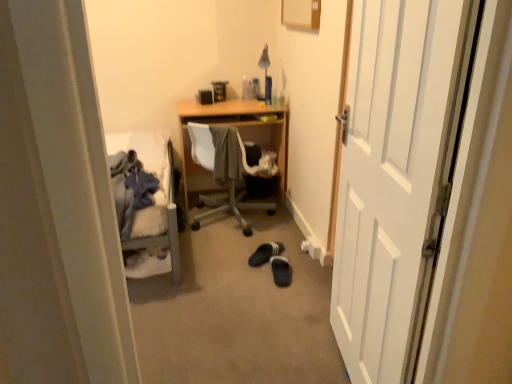
The width and height of the screenshot is (512, 384). Describe the element at coordinates (201, 145) in the screenshot. I see `wooden chair at center` at that location.

This screenshot has height=384, width=512. Describe the element at coordinates (226, 155) in the screenshot. I see `gray fabric at center, which ranks as the second clothing in left-to-right order` at that location.

Where is `gray fabric at center, the 1th clothing viewed from the right`? The height and width of the screenshot is (384, 512). gray fabric at center, the 1th clothing viewed from the right is located at coordinates (226, 155).

You are a GUI agent. You are given a task and a screenshot of the screen. Output one action in this format:
    pyautogui.click(x=<x>, y=<y>)
    Task: Click on the denim jacket at left, the second clothing in the right-to-left sequence
    The height and width of the screenshot is (384, 512).
    Given the screenshot: What is the action you would take?
    pyautogui.click(x=130, y=189)

The image size is (512, 384). Describe the element at coordinates (130, 189) in the screenshot. I see `denim jacket at left, marked as the 1th clothing in a left-to-right arrangement` at that location.

Measure the distance between point (280, 243) and camera.

A distance of 9.14 feet exists between point (280, 243) and camera.

What do you see at coordinates (265, 253) in the screenshot?
I see `black suede slippers at center, the first footwear in the back-to-front sequence` at bounding box center [265, 253].

You are a GUI agent. You are given a task and a screenshot of the screen. Output one action in this format:
    pyautogui.click(x=<x>, y=<y>)
    Task: Click on the wooden chair at center
    
    Given the screenshot: What is the action you would take?
    pyautogui.click(x=201, y=145)

From a real-world perspective, between denim jacket at left, the second clothing when ordered from back to front, and gray fabric at center, which is the 1th clothing in back-to-front order, who is vertically lower?

In real-world perspective, gray fabric at center, which is the 1th clothing in back-to-front order, is lower.

Considering the positions of point (123, 167) and point (233, 137), is point (123, 167) closer or farther from the camera than point (233, 137)?

Point (123, 167).

Is denim jacket at left, marked as the 1th clothing in a left-to-right arrangement, directly adjacent to gray fabric at center, which ranks as the second clothing in left-to-right order?

No, denim jacket at left, marked as the 1th clothing in a left-to-right arrangement, is not making contact with gray fabric at center, which ranks as the second clothing in left-to-right order.

Between denim jacket at left, marked as the 1th clothing in a front-to-back arrangement, and gray fabric at center, which is the 1th clothing in back-to-front order, which one has smaller size?

Smaller between the two is denim jacket at left, marked as the 1th clothing in a front-to-back arrangement.

Is gray fabric at center, which is counted as the 2th clothing, starting from the front, touching black suede slippers at center, the first footwear in the back-to-front sequence?

No, gray fabric at center, which is counted as the 2th clothing, starting from the front, is not with black suede slippers at center, the first footwear in the back-to-front sequence.

Choose the correct answer: Is gray fabric at center, which is the 1th clothing in back-to-front order, inside black suede slippers at center, positioned as the second footwear in front-to-back order, or outside it?

gray fabric at center, which is the 1th clothing in back-to-front order, lies outside black suede slippers at center, positioned as the second footwear in front-to-back order.

Consider the image. Is gray fabric at center, which is the 1th clothing in back-to-front order, bigger than black suede slippers at center, positioned as the second footwear in front-to-back order?

Yes.

Is gray fabric at center, the 1th clothing viewed from the right, looking in the opposite direction of black suede slippers at center, the first footwear in the back-to-front sequence?

No, gray fabric at center, the 1th clothing viewed from the right, is not facing away from black suede slippers at center, the first footwear in the back-to-front sequence.

Is black suede slippers at center floor, positioned as the second footwear in back-to-front order, facing away from wooden chair at center?

Absolutely, black suede slippers at center floor, positioned as the second footwear in back-to-front order, is directed away from wooden chair at center.

Does black suede slippers at center floor, arranged as the 1th footwear when viewed from the front, have a lesser height compared to wooden chair at center?

Correct, black suede slippers at center floor, arranged as the 1th footwear when viewed from the front, is not as tall as wooden chair at center.

Is black suede slippers at center floor, arranged as the 1th footwear when viewed from the front, positioned far away from wooden chair at center?

That's not correct — black suede slippers at center floor, arranged as the 1th footwear when viewed from the front, is a little close to wooden chair at center.

Is wooden chair at center oriented away from black suede slippers at center floor, arranged as the 1th footwear when viewed from the front?

wooden chair at center is not turned away from black suede slippers at center floor, arranged as the 1th footwear when viewed from the front.

Does wooden chair at center lie in front of black suede slippers at center floor, positioned as the second footwear in back-to-front order?

No, it is behind black suede slippers at center floor, positioned as the second footwear in back-to-front order.

From the image's perspective, which is below, wooden chair at center or black suede slippers at center floor, arranged as the 1th footwear when viewed from the front?

black suede slippers at center floor, arranged as the 1th footwear when viewed from the front.

Is white wooden door at right inside the boundaries of black suede slippers at center floor, positioned as the second footwear in back-to-front order, or outside?

white wooden door at right lies outside black suede slippers at center floor, positioned as the second footwear in back-to-front order.

From a real-world perspective, is white wooden door at right positioned above or below black suede slippers at center floor, positioned as the second footwear in back-to-front order?

From a real-world perspective, white wooden door at right is physically above black suede slippers at center floor, positioned as the second footwear in back-to-front order.

Looking at this image, from the image's perspective, is white wooden door at right over black suede slippers at center floor, positioned as the second footwear in back-to-front order?

Correct, white wooden door at right appears higher than black suede slippers at center floor, positioned as the second footwear in back-to-front order, in the image.

You are a GUI agent. You are given a task and a screenshot of the screen. Output one action in this format:
    pyautogui.click(x=<x>, y=<y>)
    Task: Click on the door lying in front of the black suede slippers at center floor, positioned as the second footwear in back-to-front order
    
    Given the screenshot: What is the action you would take?
    pyautogui.click(x=397, y=175)

Is point (244, 226) positioned in front of point (345, 182)?

No, (244, 226) is behind (345, 182).

Are wooden chair at center and white wooden door at right located far from each other?

Indeed, wooden chair at center is not near white wooden door at right.

Is wooden chair at center to the left or to the right of white wooden door at right in the image?

Based on their positions, wooden chair at center is located to the left of white wooden door at right.

Is white wooden door at right inside wooden chair at center?

No, white wooden door at right is not a part of wooden chair at center.

Is black suede slippers at center floor, positioned as the second footwear in back-to-front order, taller or shorter than black suede slippers at center, the first footwear in the back-to-front sequence?

Clearly, black suede slippers at center floor, positioned as the second footwear in back-to-front order, is shorter compared to black suede slippers at center, the first footwear in the back-to-front sequence.

Looking at their sizes, would you say black suede slippers at center floor, positioned as the second footwear in back-to-front order, is wider or thinner than black suede slippers at center, positioned as the second footwear in front-to-back order?

Considering their sizes, black suede slippers at center floor, positioned as the second footwear in back-to-front order, looks slimmer than black suede slippers at center, positioned as the second footwear in front-to-back order.

Does black suede slippers at center floor, positioned as the second footwear in back-to-front order, come in front of black suede slippers at center, positioned as the second footwear in front-to-back order?

Yes.

Is black suede slippers at center floor, positioned as the second footwear in back-to-front order, not near black suede slippers at center, positioned as the second footwear in front-to-back order?

Actually, black suede slippers at center floor, positioned as the second footwear in back-to-front order, and black suede slippers at center, positioned as the second footwear in front-to-back order, are a little close together.

At what (x,y) coordinates should I click in order to perform the action: click on clothing above the gray fabric at center, which is counted as the 2th clothing, starting from the front (from a real-world perspective). Please return your answer as a coordinate pair (x, y). This screenshot has width=512, height=384. Looking at the image, I should click on (130, 189).

You are a GUI agent. You are given a task and a screenshot of the screen. Output one action in this format:
    pyautogui.click(x=<x>, y=<y>)
    Task: Click on the 1st footwear counting from the right of the gray fabric at center, which is the 1th clothing in back-to-front order
    
    Given the screenshot: What is the action you would take?
    pyautogui.click(x=265, y=253)

Considering their positions, is denim jacket at left, the second clothing when ordered from back to front, positioned closer to wooden chair at center than black suede slippers at center, the first footwear in the back-to-front sequence?

black suede slippers at center, the first footwear in the back-to-front sequence, is positioned closer to the anchor wooden chair at center.

From the image, which object appears to be nearer to wooden chair at center, black suede slippers at center floor, arranged as the 1th footwear when viewed from the front, or gray fabric at center, which ranks as the second clothing in left-to-right order?

The object closer to wooden chair at center is gray fabric at center, which ranks as the second clothing in left-to-right order.

Considering their positions, is gray fabric at center, the 1th clothing viewed from the right, positioned closer to black suede slippers at center floor, arranged as the 1th footwear when viewed from the front, than black suede slippers at center, the first footwear in the back-to-front sequence?

black suede slippers at center, the first footwear in the back-to-front sequence, lies closer to black suede slippers at center floor, arranged as the 1th footwear when viewed from the front, than the other object.

Looking at the image, which one is located closer to wooden chair at center, white wooden door at right or black suede slippers at center, positioned as the second footwear in front-to-back order?

Based on the image, black suede slippers at center, positioned as the second footwear in front-to-back order, appears to be nearer to wooden chair at center.

Which object lies nearer to the anchor point black suede slippers at center, the first footwear in the back-to-front sequence, wooden chair at center or white wooden door at right?

wooden chair at center lies closer to black suede slippers at center, the first footwear in the back-to-front sequence, than the other object.

Based on the photo, from the image, which object appears to be nearer to black suede slippers at center floor, positioned as the second footwear in back-to-front order, white wooden door at right or wooden chair at center?

wooden chair at center.

Based on the photo, considering their positions, is black suede slippers at center floor, positioned as the second footwear in back-to-front order, positioned further to wooden chair at center than white wooden door at right?

Among the two, white wooden door at right is located further to wooden chair at center.

From the image, which object appears to be nearer to black suede slippers at center, positioned as the second footwear in front-to-back order, gray fabric at center, which is the 1th clothing in back-to-front order, or denim jacket at left, marked as the 1th clothing in a front-to-back arrangement?

gray fabric at center, which is the 1th clothing in back-to-front order, is closer to black suede slippers at center, positioned as the second footwear in front-to-back order.

Locate an element on the screen. The image size is (512, 384). footwear situated between denim jacket at left, the second clothing when ordered from back to front, and black suede slippers at center floor, arranged as the 1th footwear when viewed from the front, from left to right is located at coordinates (265, 253).

Find the location of a particular element. chair that lies between gray fabric at center, which is counted as the 2th clothing, starting from the front, and black suede slippers at center, positioned as the second footwear in front-to-back order, from top to bottom is located at coordinates (201, 145).

Identify the location of clothing between white wooden door at right and gray fabric at center, which is the 1th clothing in back-to-front order, along the z-axis. This screenshot has width=512, height=384. tap(130, 189).

This screenshot has width=512, height=384. I want to click on chair situated between denim jacket at left, marked as the 1th clothing in a left-to-right arrangement, and black suede slippers at center floor, arranged as the 1th footwear when viewed from the front, from left to right, so click(x=201, y=145).